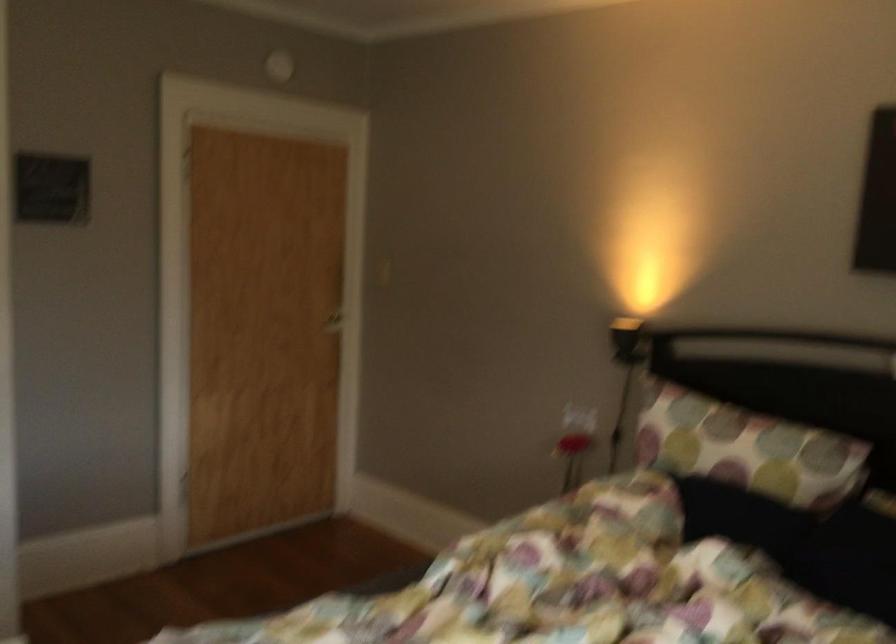
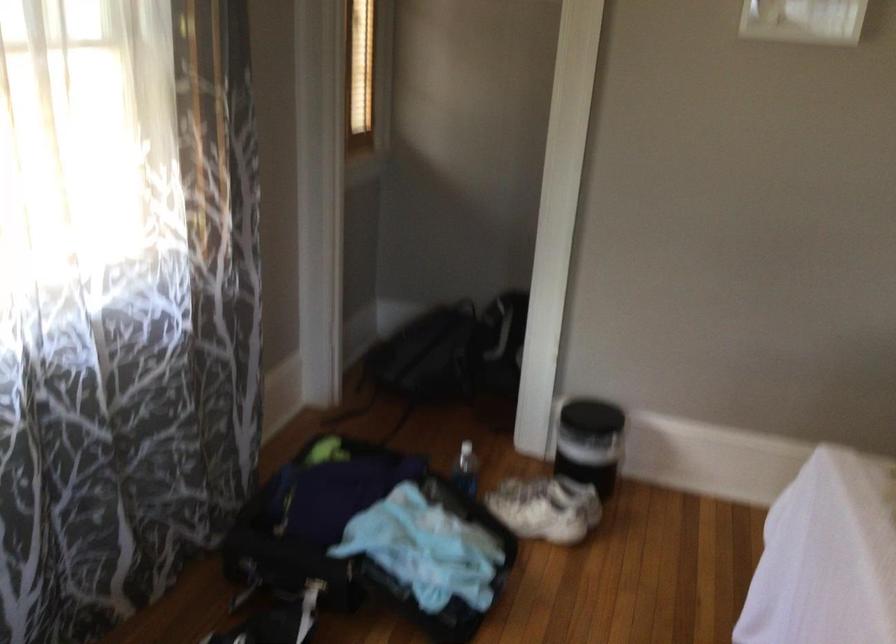
Question: The images are taken continuously from a first-person perspective. In which direction is your viewpoint rotating?

Choices:
 (A) Left
 (B) Right
 (C) Up
 (D) Down

Answer: (A)